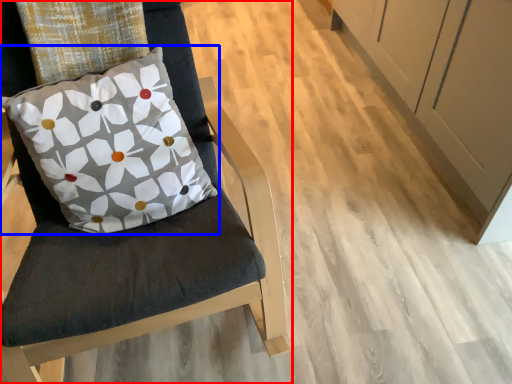
Question: Which point is closer to the camera, chair (highlighted by a red box) or pillow (highlighted by a blue box)?

Choices:
 (A) chair
 (B) pillow

Answer: (A)